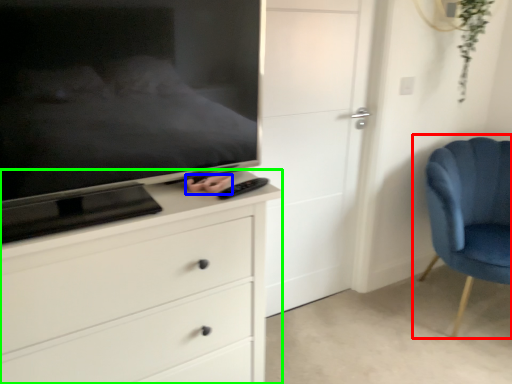
Question: Which object is positioned closest to chair (highlighted by a red box)? Select from hand (highlighted by a blue box) and chest of drawers (highlighted by a green box).

Choices:
 (A) hand
 (B) chest of drawers

Answer: (B)